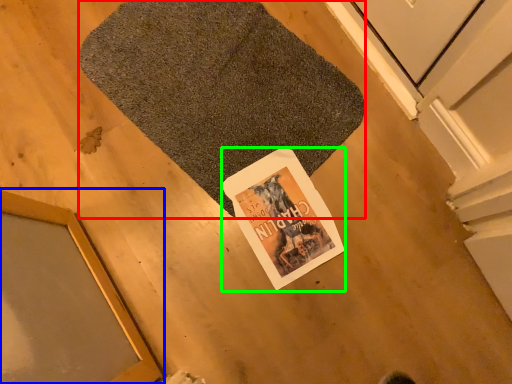
Question: Based on their relative distances, which object is nearer to bath mat (highlighted by a red box)? Choose from window (highlighted by a blue box) and magazine (highlighted by a green box).

Choices:
 (A) window
 (B) magazine

Answer: (B)